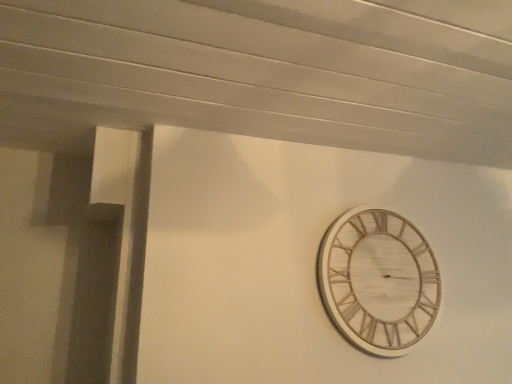
Looking at this image, in order to face white wood wall clock at upper right, should I rotate leftwards or rightwards?

Rotate right and turn 17.136 degrees.

What do you see at coordinates (378, 281) in the screenshot? I see `white wood wall clock at upper right` at bounding box center [378, 281].

Locate an element on the screen. The width and height of the screenshot is (512, 384). white wood wall clock at upper right is located at coordinates (378, 281).

At what (x,y) coordinates should I click in order to perform the action: click on white wood wall clock at upper right. Please return your answer as a coordinate pair (x, y). The width and height of the screenshot is (512, 384). Looking at the image, I should click on (378, 281).